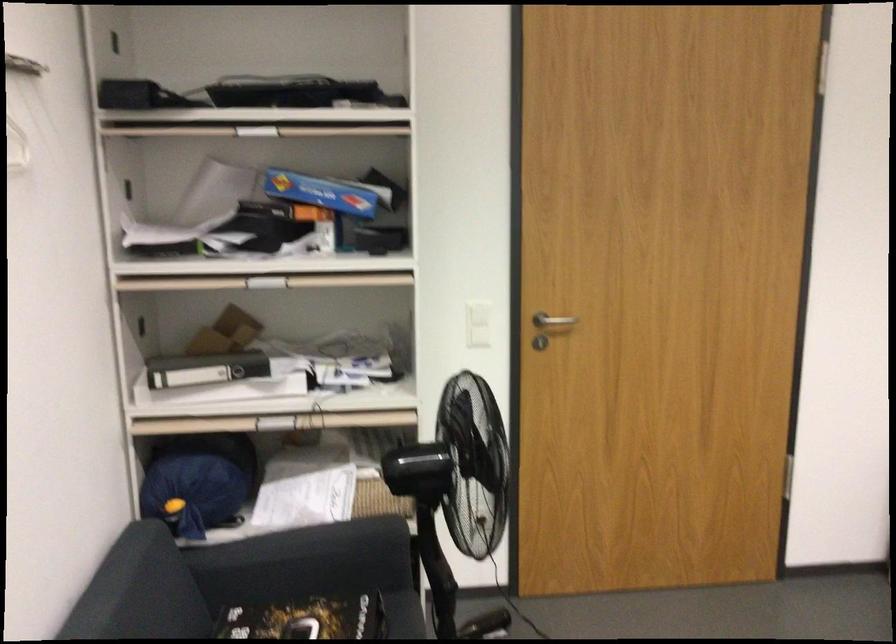
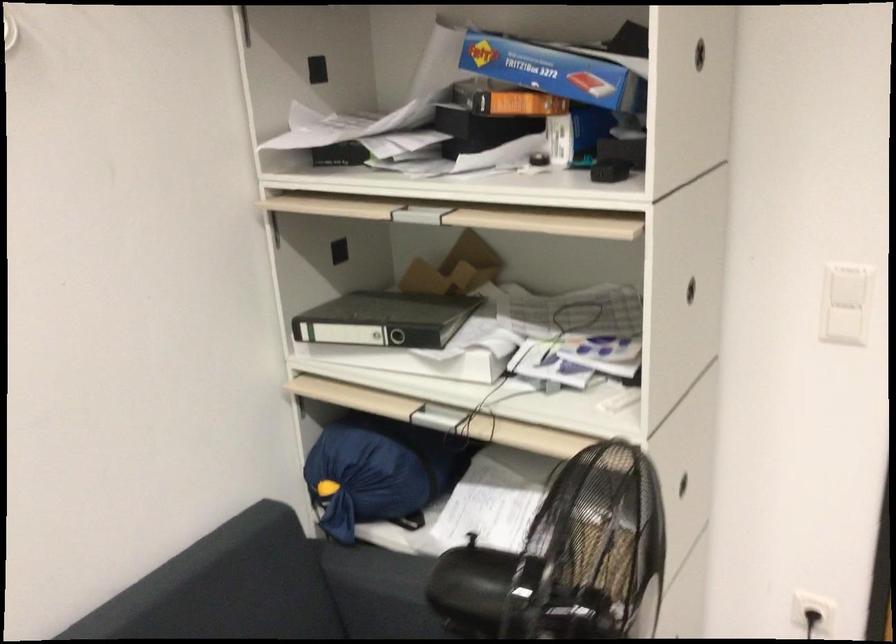
Locate, in the second image, the point that corresponds to the point at 480,339 in the first image.

(843, 326)